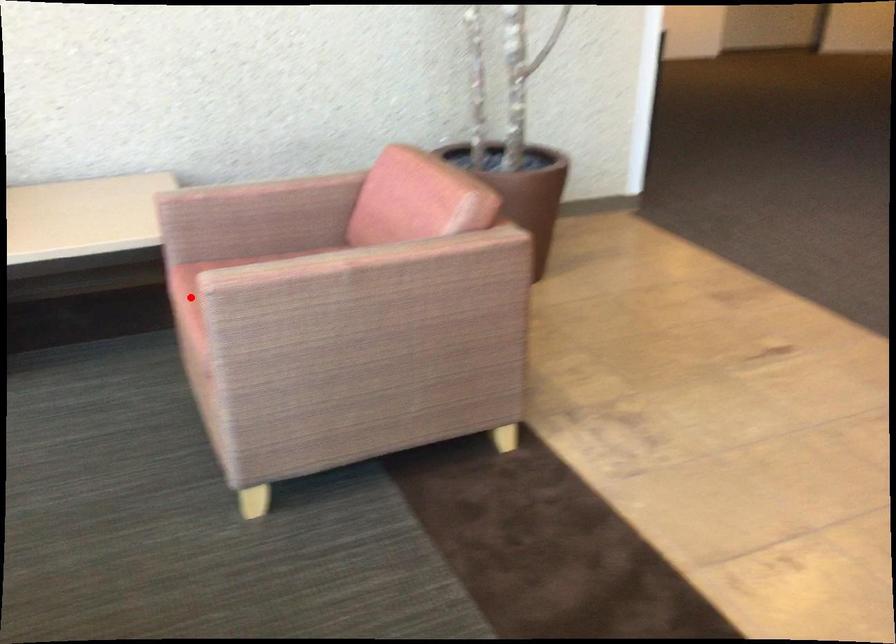
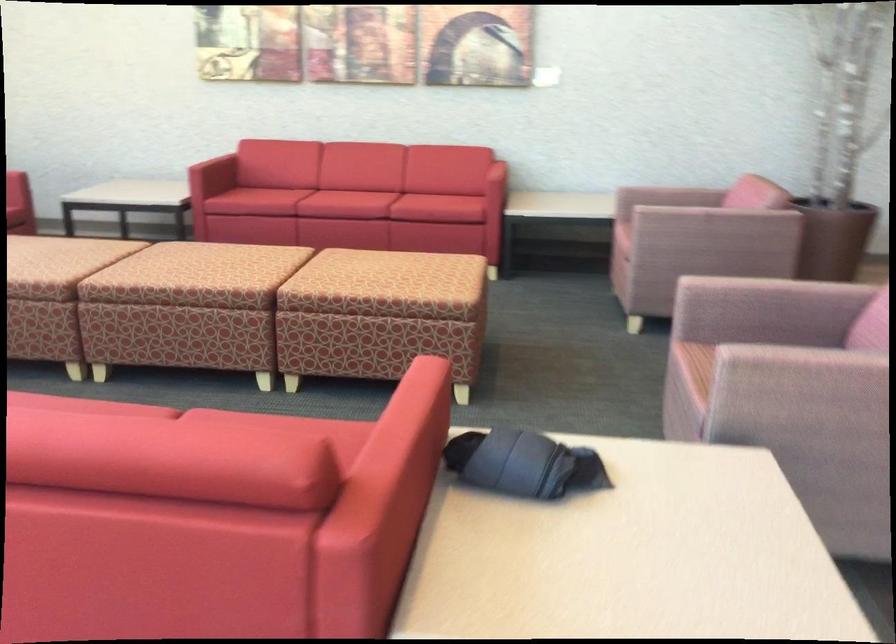
Question: I am providing you with two images of the same scene from different viewpoints. In image1, a red point is highlighted. Considering the same 3D point in image2, which of the following is correct?

Choices:
 (A) It is closer
 (B) It is farther

Answer: (B)